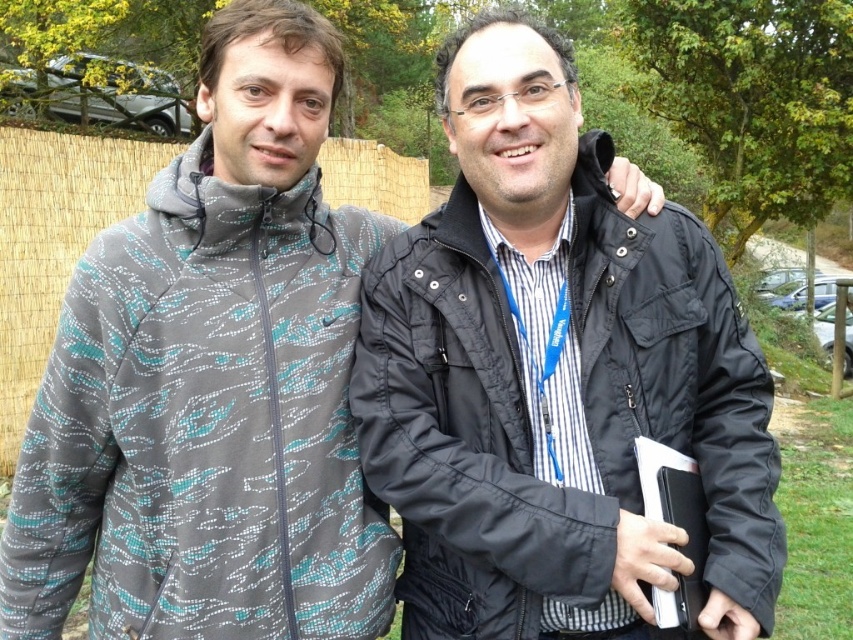
From the picture: Does gray printed jacket at left have a lesser height compared to black quilted jacket at center?

In fact, gray printed jacket at left may be taller than black quilted jacket at center.

Is gray printed jacket at left wider than black quilted jacket at center?

Yes.

Describe the element at coordinates (204, 428) in the screenshot. I see `gray printed jacket at left` at that location.

You are a GUI agent. You are given a task and a screenshot of the screen. Output one action in this format:
    pyautogui.click(x=<x>, y=<y>)
    Task: Click on the gray printed jacket at left
    
    Given the screenshot: What is the action you would take?
    pyautogui.click(x=204, y=428)